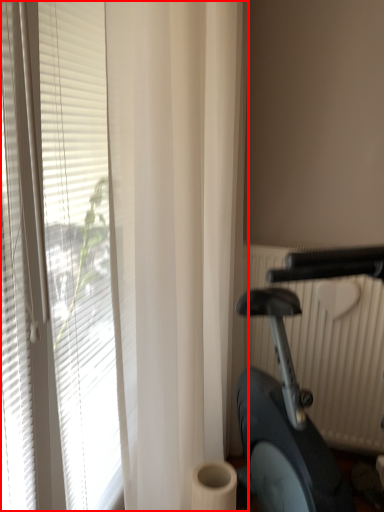
Question: From the image's perspective, where is window blind (annotated by the red box) located in relation to stationary bicycle in the image?

Choices:
 (A) below
 (B) above

Answer: (B)